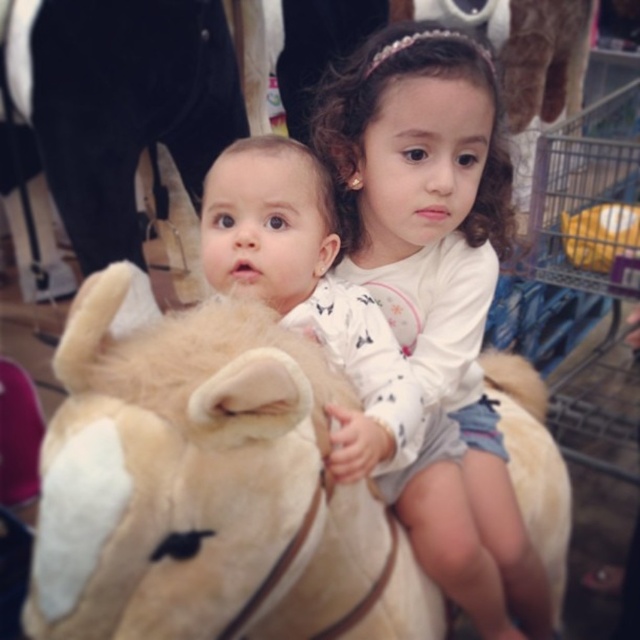
From the picture: Is fluffy beige horse at center above white soft plush at center?

No.

Is point (108, 268) positioned after point (364, 154)?

Yes.

Is point (285, 516) farther from viewer compared to point (333, 145)?

No, (285, 516) is closer to viewer.

What are the coordinates of `fluffy beige horse at center` in the screenshot? It's located at click(x=172, y=465).